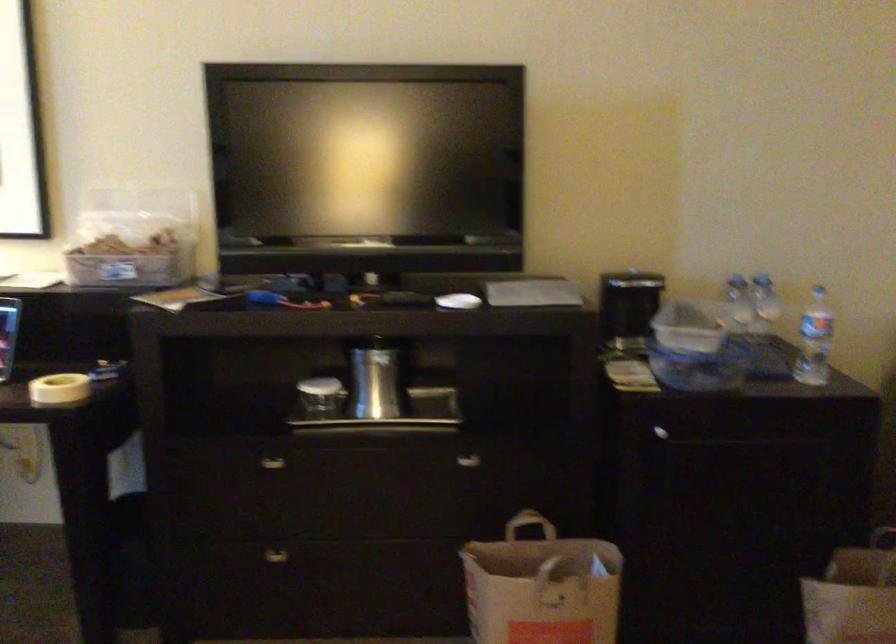
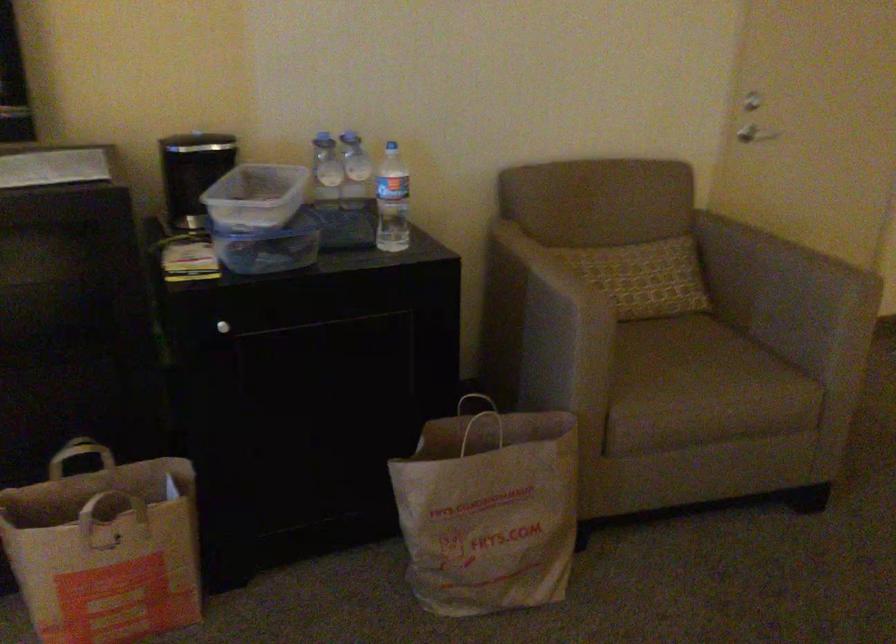
Where in the second image is the point corresponding to point (771, 303) from the first image?

(355, 171)